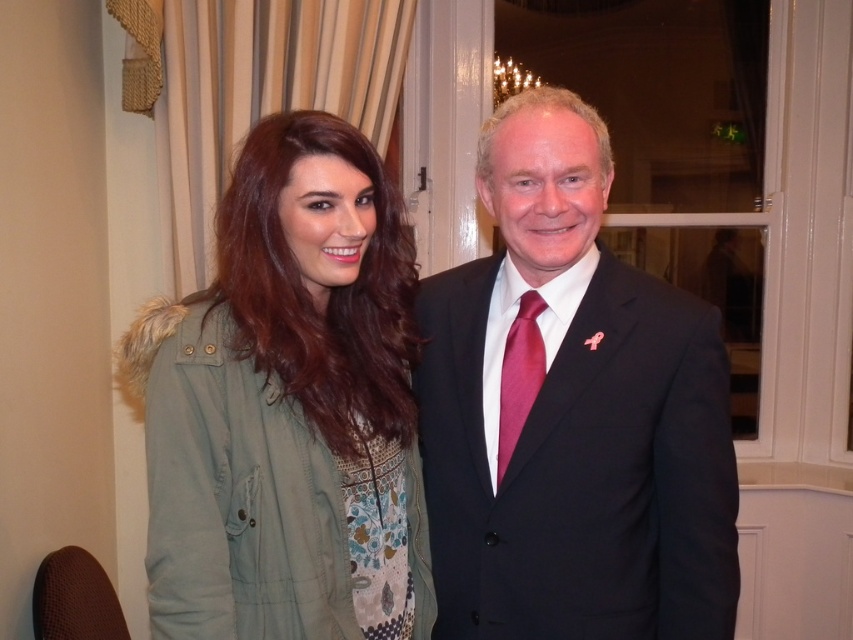
You are standing in the room and want to locate the black suit at center. What are the coordinates where you should look?

The black suit at center is located at coordinates point [572,413].

You are organizing a photo shoot and need to arrange two outfits on a mannequin stand. The stand can only hold items that are the same width. Given the black suit at center and the green fabric jacket at left, which outfit should you choose to ensure they fit properly?

The black suit at center is wider than the green fabric jacket at left, so you should choose the green fabric jacket at left to ensure they fit properly on the mannequin stand.